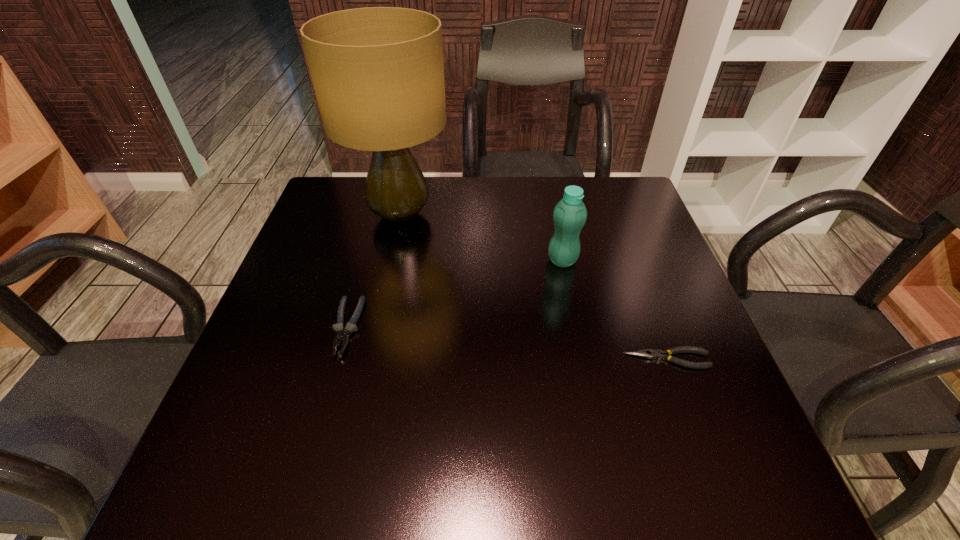
Locate an element on the screen. The image size is (960, 540). vacant area located at the gripping part of the third tallest object is located at coordinates (325, 406).

The image size is (960, 540). Identify the location of free space located 0.050m on the back of the rightmost object. (656, 329).

Find the location of a particular element. object that is at the far edge is located at coordinates (378, 73).

Image resolution: width=960 pixels, height=540 pixels. What are the coordinates of `lampshade positioned at the left edge` in the screenshot? It's located at (378, 73).

You are a GUI agent. You are given a task and a screenshot of the screen. Output one action in this format:
    pyautogui.click(x=<x>, y=<y>)
    Task: Click on the pliers that is at the left edge
    This screenshot has width=960, height=540.
    Given the screenshot: What is the action you would take?
    pyautogui.click(x=342, y=335)

The image size is (960, 540). In order to click on object located in the right edge section of the desktop in this screenshot , I will do `click(644, 353)`.

Image resolution: width=960 pixels, height=540 pixels. I want to click on object located in the far left corner section of the desktop, so click(x=378, y=73).

In the image, there is a desktop. Find the location of `free space at the far edge`. free space at the far edge is located at coordinates (429, 191).

Image resolution: width=960 pixels, height=540 pixels. I want to click on vacant space at the near edge of the desktop, so click(362, 491).

Locate an element on the screen. vacant space at the left edge of the desktop is located at coordinates (251, 350).